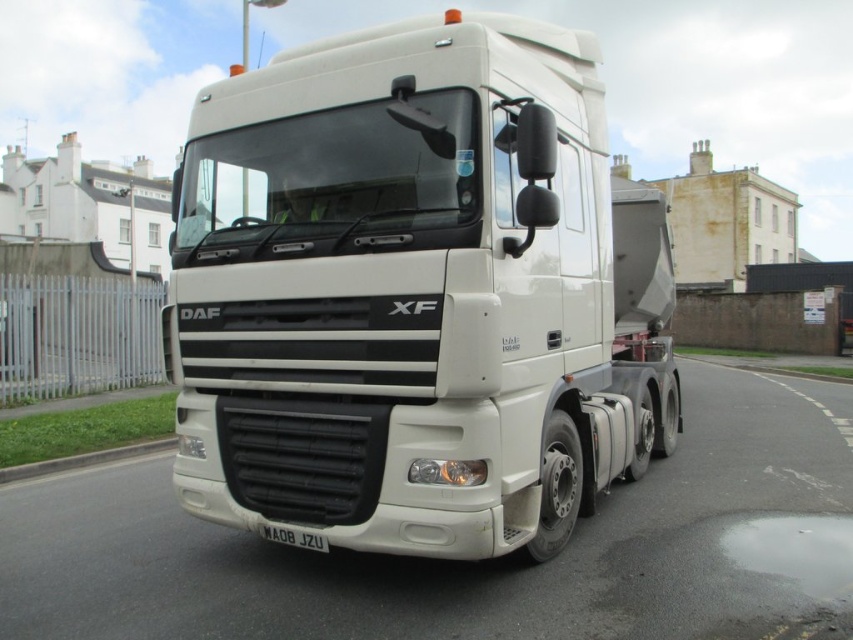
Can you confirm if white matte trailer truck at center is wider than white matte license plate at center?

In fact, white matte trailer truck at center might be narrower than white matte license plate at center.

Which is behind, point (402, 422) or point (328, 544)?

Positioned behind is point (328, 544).

Based on the photo, who is more distant from viewer, [247,134] or [270,532]?

Positioned behind is point [247,134].

Identify the location of white matte trailer truck at center. The height and width of the screenshot is (640, 853). (416, 294).